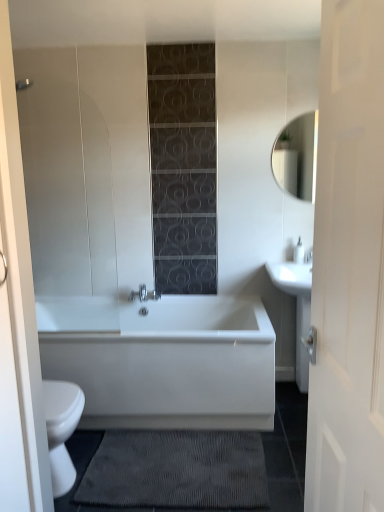
Question: Is matte white mirror at upper right oriented away from white glossy bathtub at center?

Choices:
 (A) no
 (B) yes

Answer: (A)

Question: Is matte white mirror at upper right not close to white glossy bathtub at center?

Choices:
 (A) no
 (B) yes

Answer: (B)

Question: From a real-world perspective, is matte white mirror at upper right over white glossy bathtub at center?

Choices:
 (A) yes
 (B) no

Answer: (A)

Question: Can you confirm if matte white mirror at upper right is taller than white glossy bathtub at center?

Choices:
 (A) no
 (B) yes

Answer: (B)

Question: Does matte white mirror at upper right come in front of white glossy bathtub at center?

Choices:
 (A) yes
 (B) no

Answer: (B)

Question: Is matte white mirror at upper right aimed at white glossy bathtub at center?

Choices:
 (A) yes
 (B) no

Answer: (B)

Question: From the image's perspective, is white wood door at right above matte silver faucet at upper right?

Choices:
 (A) no
 (B) yes

Answer: (A)

Question: Is white wood door at right at the left side of matte silver faucet at upper right?

Choices:
 (A) yes
 (B) no

Answer: (A)

Question: Does white wood door at right have a greater height compared to matte silver faucet at upper right?

Choices:
 (A) yes
 (B) no

Answer: (A)

Question: Is white wood door at right positioned with its back to matte silver faucet at upper right?

Choices:
 (A) no
 (B) yes

Answer: (A)

Question: Does white wood door at right have a larger size compared to matte silver faucet at upper right?

Choices:
 (A) no
 (B) yes

Answer: (B)

Question: Can you confirm if white wood door at right is thinner than matte silver faucet at upper right?

Choices:
 (A) no
 (B) yes

Answer: (B)

Question: Considering the relative sizes of matte white mirror at upper right and white glossy sink at right in the image provided, is matte white mirror at upper right smaller than white glossy sink at right?

Choices:
 (A) no
 (B) yes

Answer: (B)